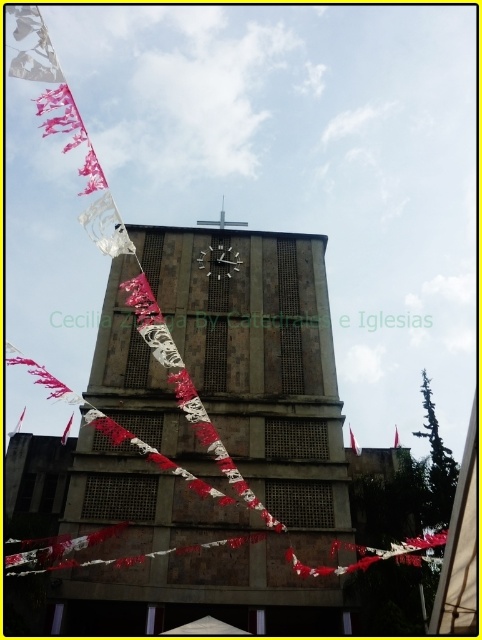
Between brown textured stone clock tower at center and red fabric flag at upper center, which one has less height?

With less height is red fabric flag at upper center.

Which is above, brown textured stone clock tower at center or red fabric flag at upper center?

brown textured stone clock tower at center is above.

Is point (254, 259) closer to viewer compared to point (395, 433)?

Yes, it is in front of point (395, 433).

Locate an element on the screen. The width and height of the screenshot is (482, 640). brown textured stone clock tower at center is located at coordinates (262, 365).

Does metallic clock at center have a smaller size compared to white fabric flag at upper center?

Yes, metallic clock at center is smaller than white fabric flag at upper center.

Can you confirm if metallic clock at center is wider than white fabric flag at upper center?

Incorrect, metallic clock at center's width does not surpass white fabric flag at upper center's.

Which is in front, point (212, 252) or point (360, 451)?

Point (360, 451) is more forward.

Where is `metallic clock at center`? The width and height of the screenshot is (482, 640). metallic clock at center is located at coordinates (218, 259).

Consider the image. Who is positioned more to the left, white fabric flag at upper center or white paper flag at lower left?

white paper flag at lower left is more to the left.

At what (x,y) coordinates should I click in order to perform the action: click on white fabric flag at upper center. Please return your answer as a coordinate pair (x, y). The height and width of the screenshot is (640, 482). Looking at the image, I should click on (353, 442).

Locate an element on the screen. white fabric flag at upper center is located at coordinates (353, 442).